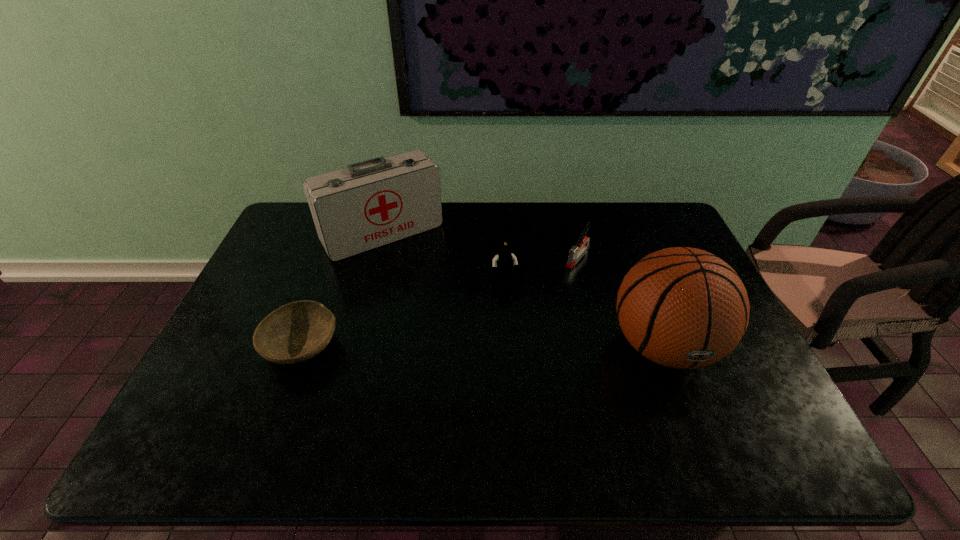
Identify the location of the first-aid kit that is at the left edge. (372, 203).

Locate an element on the screen. object present at the right edge is located at coordinates (681, 307).

The width and height of the screenshot is (960, 540). What are the coordinates of `object that is at the far left corner` in the screenshot? It's located at (372, 203).

This screenshot has height=540, width=960. What are the coordinates of `object that is at the near right corner` in the screenshot? It's located at (681, 307).

This screenshot has width=960, height=540. What are the coordinates of `vacant space at the far edge` in the screenshot? It's located at (487, 239).

Identify the location of vacant space at the near edge. (487, 406).

At what (x,y) coordinates should I click in order to perform the action: click on vacant area at the left edge of the desktop. Please return your answer as a coordinate pair (x, y). Looking at the image, I should click on (215, 373).

The width and height of the screenshot is (960, 540). In the image, there is a desktop. Find the location of `vacant space at the near left corner`. vacant space at the near left corner is located at coordinates (228, 398).

The width and height of the screenshot is (960, 540). What are the coordinates of `vacant space at the far right corner` in the screenshot? It's located at (626, 207).

Locate an element on the screen. unoccupied area between the third farthest object and the bowl is located at coordinates (403, 313).